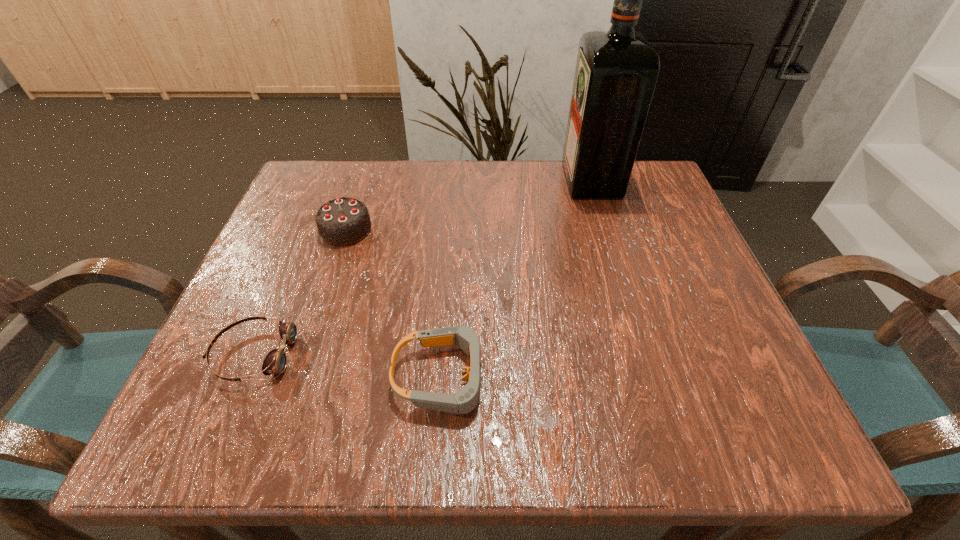
Identify the location of object that is at the far left corner. The image size is (960, 540). (343, 221).

The width and height of the screenshot is (960, 540). I want to click on object situated at the far right corner, so click(x=616, y=72).

Find the location of `vacant region at the far edge of the desktop`. vacant region at the far edge of the desktop is located at coordinates (548, 195).

The image size is (960, 540). I want to click on vacant space at the left edge, so click(263, 334).

You are a GUI agent. You are given a task and a screenshot of the screen. Output one action in this format:
    pyautogui.click(x=<x>, y=<y>)
    Task: Click on the blank space at the right edge
    The width and height of the screenshot is (960, 540).
    Given the screenshot: What is the action you would take?
    pyautogui.click(x=714, y=314)

Where is `vacant space at the far left corner of the desktop`? vacant space at the far left corner of the desktop is located at coordinates (347, 179).

Identify the location of vacant region at the far right corner of the desktop. (622, 210).

In order to click on free space at the near right corner in this screenshot , I will do `click(739, 421)`.

The image size is (960, 540). In order to click on free point between the tallest object and the right goggles in this screenshot , I will do `click(517, 279)`.

What are the coordinates of `free space between the third object from left to right and the tallest object` in the screenshot? It's located at (517, 279).